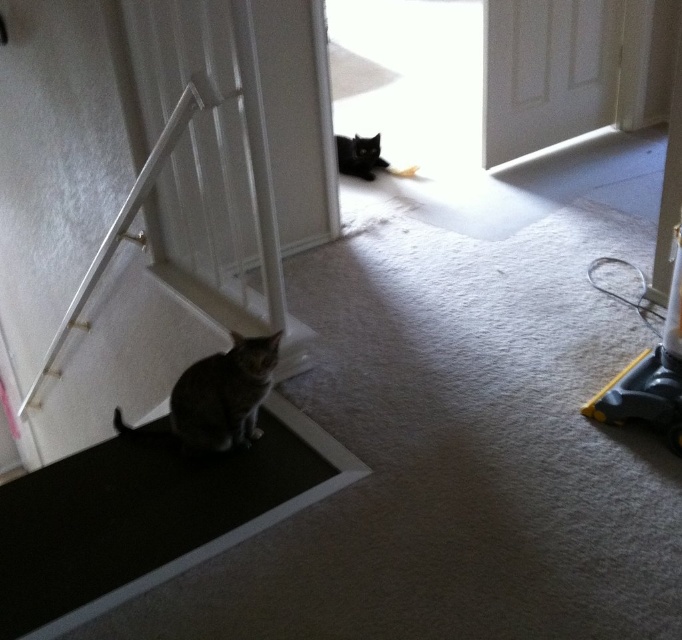
Question: Does white glossy door at upper center appear on the left side of gray striped cat at lower left?

Choices:
 (A) no
 (B) yes

Answer: (A)

Question: Is dark gray rubber doormat at lower left to the right of white glossy door at upper center from the viewer's perspective?

Choices:
 (A) no
 (B) yes

Answer: (A)

Question: Is white glossy door at upper center to the left of gray striped cat at lower left from the viewer's perspective?

Choices:
 (A) yes
 (B) no

Answer: (B)

Question: Which of these objects is positioned closest to the white glossy door at upper center?

Choices:
 (A) black glossy cat at upper center
 (B) gray striped cat at lower left
 (C) dark gray rubber doormat at lower left

Answer: (A)

Question: Which of the following is the closest to the observer?

Choices:
 (A) (220, 426)
 (B) (355, 150)
 (C) (113, 592)

Answer: (C)

Question: Considering the real-world distances, which object is closest to the black glossy cat at upper center?

Choices:
 (A) gray striped cat at lower left
 (B) dark gray rubber doormat at lower left
 (C) white glossy door at upper center

Answer: (C)